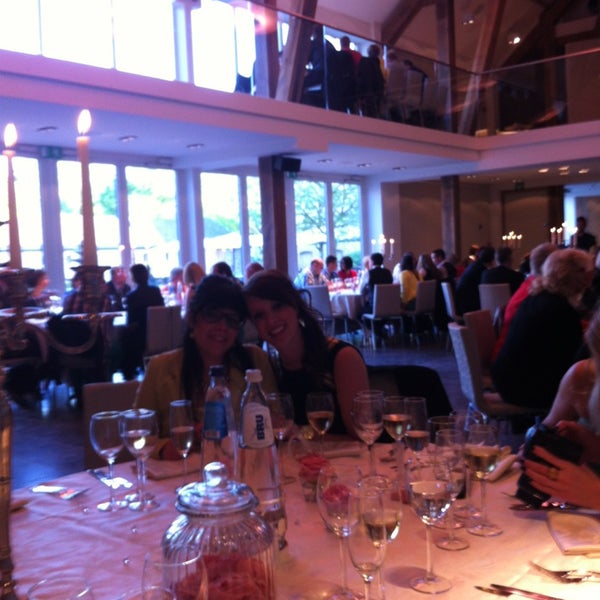
Locate an element on the screen. This screenshot has width=600, height=600. glass lid is located at coordinates (212, 499).